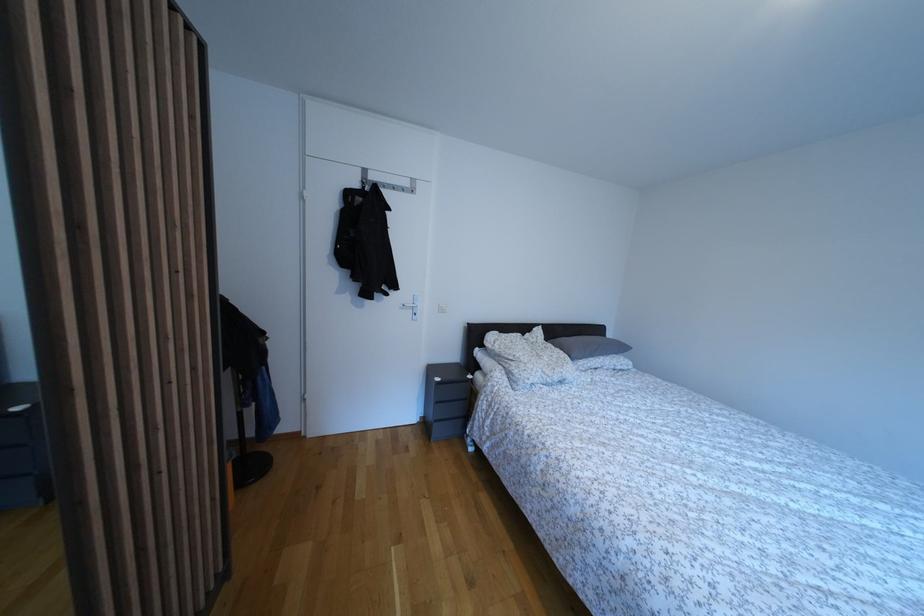
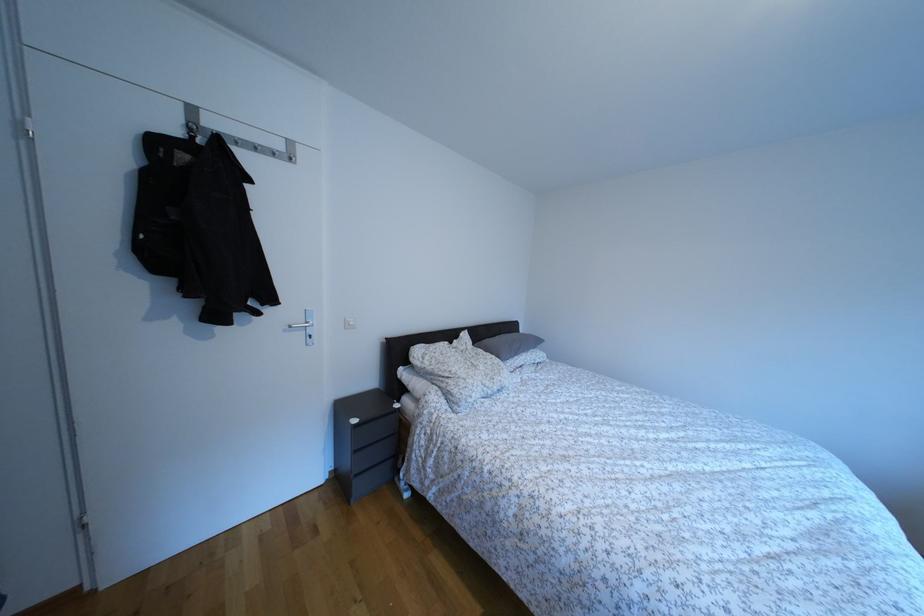
Find the pixel in the second image that matches the point at 616,341 in the first image.

(529, 336)